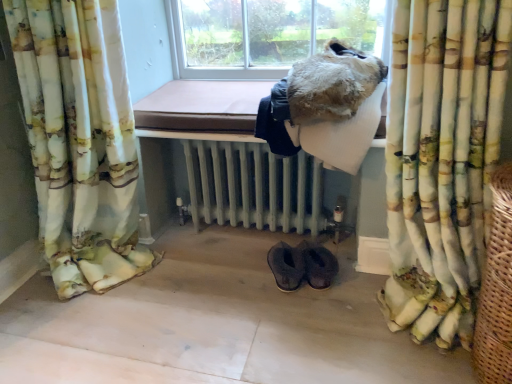
At what (x,y) coordinates should I click in order to perform the action: click on vacant region to the left of brown suede slippers at lower center. Please return your answer as a coordinate pair (x, y). The width and height of the screenshot is (512, 384). Looking at the image, I should click on (236, 296).